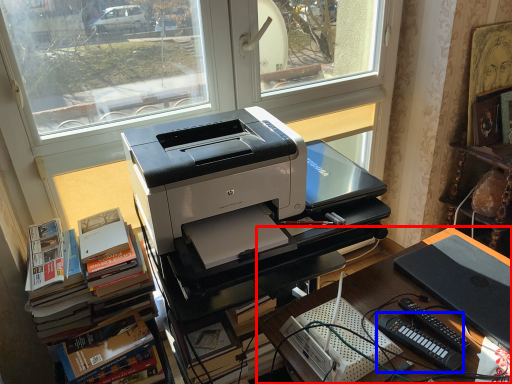
Question: Which point is further to the camera, desk (highlighted by a red box) or equipment (highlighted by a blue box)?

Choices:
 (A) desk
 (B) equipment

Answer: (B)